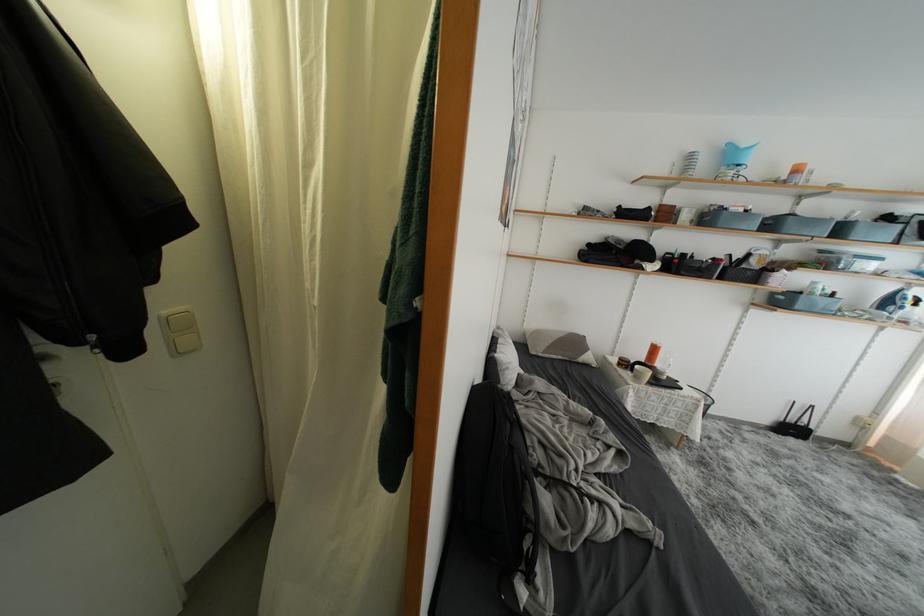
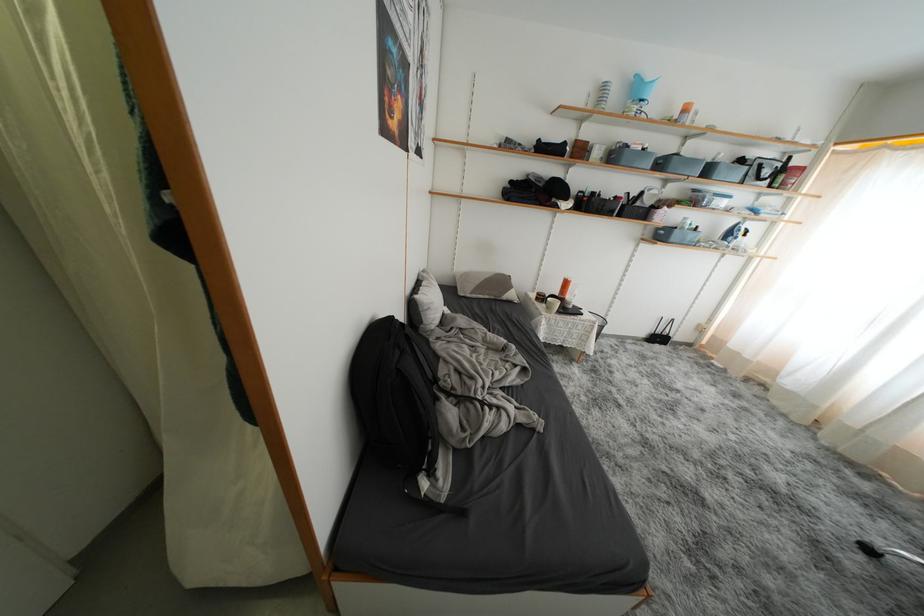
Where in the second image is the point corresponding to the point at 582,346 from the first image?

(508, 286)